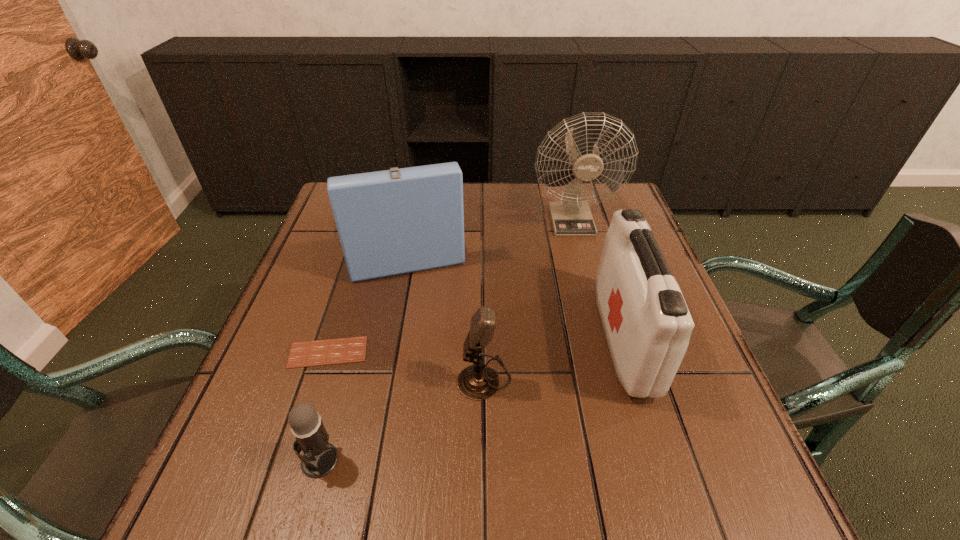
Where is `free space between the shortest object and the tallest object`? free space between the shortest object and the tallest object is located at coordinates (449, 286).

Find the location of `free spot between the phonograph record and the chocolate bar`. free spot between the phonograph record and the chocolate bar is located at coordinates (365, 295).

At what (x,y) coordinates should I click in order to perform the action: click on free space between the left microphone and the chocolate bar. Please return your answer as a coordinate pair (x, y). Looking at the image, I should click on (324, 406).

The height and width of the screenshot is (540, 960). I want to click on free area in between the chocolate bar and the phonograph record, so click(365, 295).

You are a GUI agent. You are given a task and a screenshot of the screen. Output one action in this format:
    pyautogui.click(x=<x>, y=<y>)
    Task: Click on the object that ranks as the fifth closest to the chocolate bar
    
    Given the screenshot: What is the action you would take?
    pyautogui.click(x=572, y=217)

Identify which object is located as the nearest to the fan. Please provide its 2D coordinates. Your answer should be formatted as a tuple, i.e. [(x, y)], where the tuple contains the x and y coordinates of a point satisfying the conditions above.

[(397, 221)]

At what (x,y) coordinates should I click in order to perform the action: click on blank space that satisfies the following two spatial constraints: 1. on the air flow direction of the tallest object; 2. on the front-facing side of the fourth tallest object. Please return your answer as a coordinate pair (x, y). Image resolution: width=960 pixels, height=540 pixels. Looking at the image, I should click on (613, 377).

Where is `vacant space that satisfies the following two spatial constraints: 1. on the air flow direction of the tallest object; 2. on the front-facing side of the taller microphone`? vacant space that satisfies the following two spatial constraints: 1. on the air flow direction of the tallest object; 2. on the front-facing side of the taller microphone is located at coordinates (613, 377).

Where is `free space in the image that satisfies the following two spatial constraints: 1. on the air flow direction of the tallest object; 2. on the front-facing side of the right microphone`? The image size is (960, 540). free space in the image that satisfies the following two spatial constraints: 1. on the air flow direction of the tallest object; 2. on the front-facing side of the right microphone is located at coordinates (613, 377).